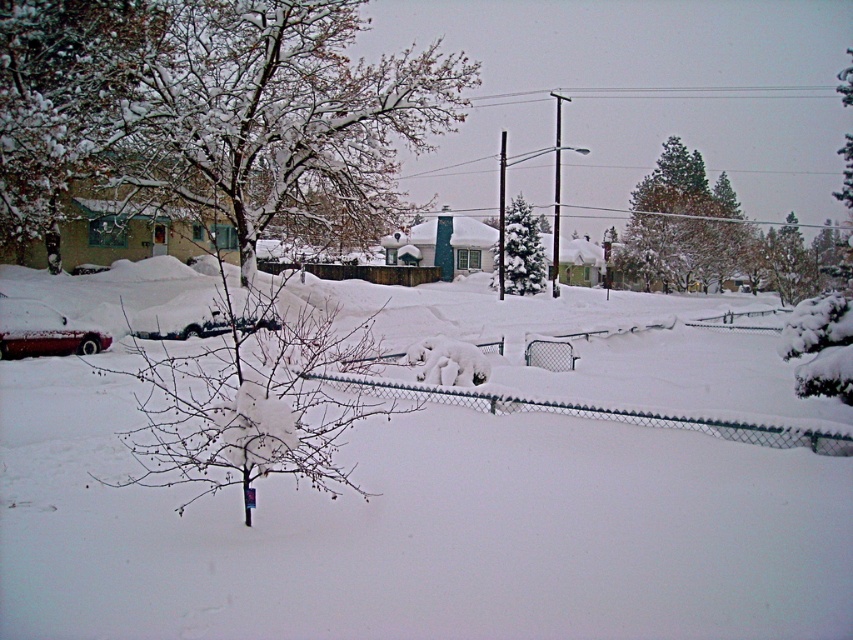
Question: Which point is closer to the camera?

Choices:
 (A) snow-covered evergreen at center
 (B) green textured pine tree at upper right
 (C) snow-covered evergreen tree at upper right
 (D) smooth wood utility pole at center

Answer: (C)

Question: Does chain-link fence at center appear over snow-covered evergreen at center?

Choices:
 (A) yes
 (B) no

Answer: (B)

Question: Which of these objects is positioned farthest from the snow-covered evergreen at center?

Choices:
 (A) white fluffy snow at center
 (B) snow-covered evergreen tree at upper right
 (C) wooden fence at center
 (D) smooth wood utility pole at center

Answer: (B)

Question: Is snow-covered tree at center positioned in front of snow-covered evergreen tree at upper right?

Choices:
 (A) no
 (B) yes

Answer: (B)

Question: Which point is farther to the camera?

Choices:
 (A) (334, 276)
 (B) (820, 388)
 (C) (689, 189)

Answer: (C)

Question: Is snow-covered tree at center bigger than chain-link fence at center?

Choices:
 (A) yes
 (B) no

Answer: (A)